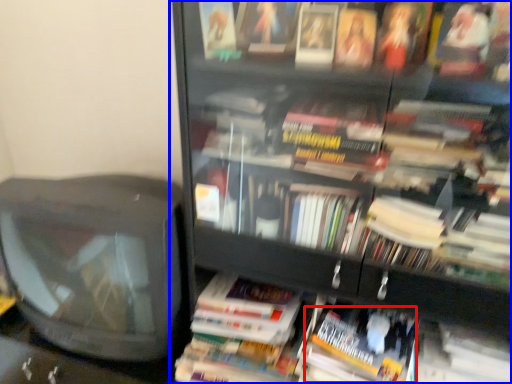
Question: Among these objects, which one is nearest to the camera, paperback book (highlighted by a red box) or bookcase (highlighted by a blue box)?

Choices:
 (A) paperback book
 (B) bookcase

Answer: (B)